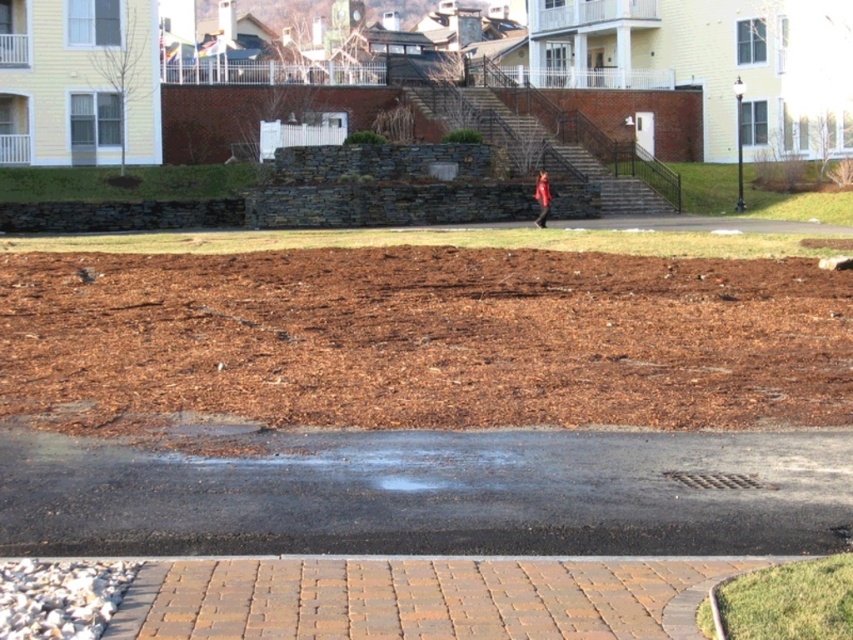
You are standing at the origin point in the image. Which direction should you move to reach the brown mulch at center?

The brown mulch at center is located at coordinates approximately 0.530 on the x and 0.498 on the y axis. Since the origin is at the bottom left corner, moving towards the center would require moving northeast.

From the picture: You are a gardener who needs to access the brown stone stairs at center to trim some overgrown ivy. However, the brown mulch at center is covering the area directly below the stairs. Is there a clear path to reach the stairs without stepping on the mulch?

The brown mulch at center is positioned under the brown stone stairs at center, so there is no clear path to reach the stairs without stepping on the mulch. You will have to step on the mulch to access the stairs.